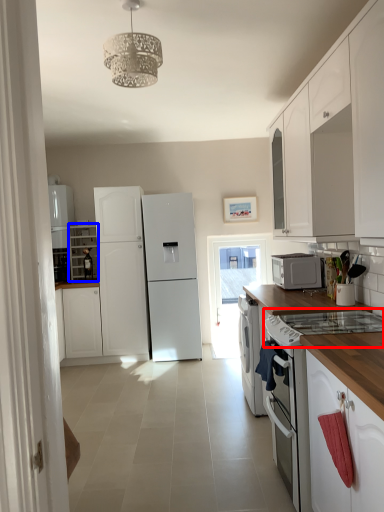
Question: Which object appears closest to the camera in this image, gas stove (highlighted by a red box) or cabinetry (highlighted by a blue box)?

Choices:
 (A) gas stove
 (B) cabinetry

Answer: (A)